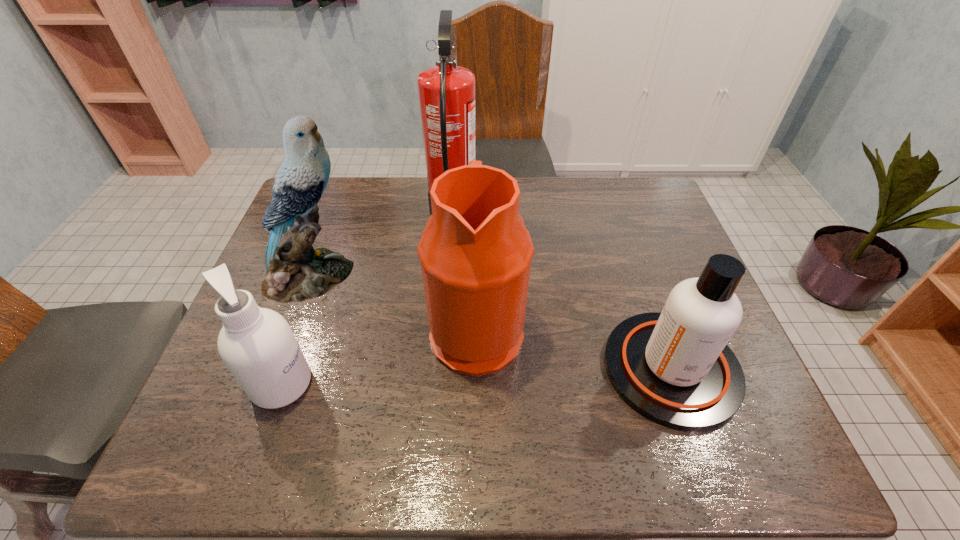
This screenshot has height=540, width=960. Find the location of `vacant space located 0.060m on the left of the right cleansing agent`. vacant space located 0.060m on the left of the right cleansing agent is located at coordinates (578, 368).

You are a GUI agent. You are given a task and a screenshot of the screen. Output one action in this format:
    pyautogui.click(x=<x>, y=<y>)
    Task: Click on the object situated at the far edge
    The height and width of the screenshot is (540, 960).
    Given the screenshot: What is the action you would take?
    pyautogui.click(x=446, y=91)

The height and width of the screenshot is (540, 960). What are the coordinates of `object located in the near edge section of the desktop` in the screenshot? It's located at (674, 367).

Find the location of a particular element. parakeet that is at the left edge is located at coordinates (296, 272).

At what (x,y) coordinates should I click in order to perform the action: click on cleansing agent positioned at the left edge. Please return your answer as a coordinate pair (x, y). Looking at the image, I should click on (258, 346).

Locate an element on the screen. object situated at the right edge is located at coordinates (674, 367).

Identify the location of object that is at the near right corner. (674, 367).

You are a GUI agent. You are given a task and a screenshot of the screen. Output one action in this format:
    pyautogui.click(x=<x>, y=<y>)
    Task: Click on the free space at the far edge of the desktop
    Image resolution: width=960 pixels, height=540 pixels.
    Given the screenshot: What is the action you would take?
    pyautogui.click(x=403, y=193)

The width and height of the screenshot is (960, 540). I want to click on blank space at the near edge, so 488,459.

Locate an element on the screen. vacant space at the far left corner is located at coordinates (324, 205).